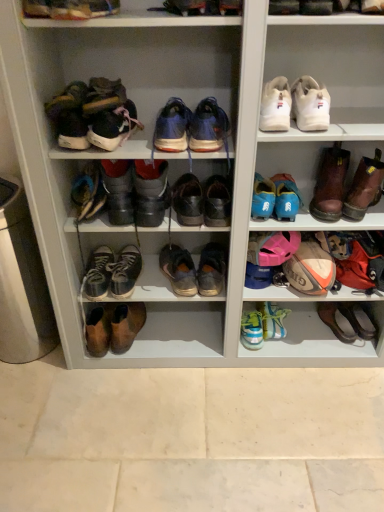
Question: Considering the relative sizes of white leather sneakers at upper right, which is counted as the ninth footwear, starting from the left, and worn leather shoes at center, placed as the 5th footwear when sorted from right to left, in the image provided, is white leather sneakers at upper right, which is counted as the ninth footwear, starting from the left, shorter than worn leather shoes at center, placed as the 5th footwear when sorted from right to left,?

Choices:
 (A) yes
 (B) no

Answer: (A)

Question: From the image's perspective, does white leather sneakers at upper right, which is counted as the ninth footwear, starting from the left, appear lower than worn leather shoes at center, placed as the 5th footwear when sorted from right to left?

Choices:
 (A) no
 (B) yes

Answer: (A)

Question: Can you confirm if white leather sneakers at upper right, which is counted as the ninth footwear, starting from the left, is positioned to the right of worn leather shoes at center, placed as the 5th footwear when sorted from right to left?

Choices:
 (A) no
 (B) yes

Answer: (B)

Question: Is white leather sneakers at upper right, which is counted as the ninth footwear, starting from the left, touching worn leather shoes at center, placed as the 7th footwear when sorted from left to right?

Choices:
 (A) no
 (B) yes

Answer: (A)

Question: Is white leather sneakers at upper right, which is counted as the ninth footwear, starting from the left, positioned behind worn leather shoes at center, placed as the 7th footwear when sorted from left to right?

Choices:
 (A) no
 (B) yes

Answer: (A)

Question: From a real-world perspective, is white leather sneakers at upper right, which ranks as the 3th footwear in right-to-left order, physically below worn leather shoes at center, placed as the 5th footwear when sorted from right to left?

Choices:
 (A) yes
 (B) no

Answer: (B)

Question: Is leather lace-up shoe at center, positioned as the 3th shoe in left-to-right order, located outside shiny blue sneakers at center, arranged as the 6th footwear when viewed from the right?

Choices:
 (A) yes
 (B) no

Answer: (A)

Question: From a real-world perspective, does leather lace-up shoe at center, positioned as the 3th shoe in left-to-right order, sit lower than shiny blue sneakers at center, arranged as the 6th footwear when viewed from the right?

Choices:
 (A) yes
 (B) no

Answer: (A)

Question: From a real-world perspective, is leather lace-up shoe at center, positioned as the 3th shoe in left-to-right order, positioned over shiny blue sneakers at center, placed as the sixth footwear when sorted from left to right, based on gravity?

Choices:
 (A) no
 (B) yes

Answer: (A)

Question: Considering the relative sizes of leather lace-up shoe at center, which is the 7th shoe in right-to-left order, and shiny blue sneakers at center, arranged as the 6th footwear when viewed from the right, in the image provided, is leather lace-up shoe at center, which is the 7th shoe in right-to-left order, bigger than shiny blue sneakers at center, arranged as the 6th footwear when viewed from the right,?

Choices:
 (A) yes
 (B) no

Answer: (A)

Question: Is leather lace-up shoe at center, which is the 7th shoe in right-to-left order, oriented towards shiny blue sneakers at center, arranged as the 6th footwear when viewed from the right?

Choices:
 (A) yes
 (B) no

Answer: (B)

Question: Would you say leather lace-up shoe at center, which is the 7th shoe in right-to-left order, is a long distance from shiny blue sneakers at center, arranged as the 6th footwear when viewed from the right?

Choices:
 (A) yes
 (B) no

Answer: (B)

Question: From the image's perspective, would you say leather at center, which appears as the 4th shoe when viewed from the right, is shown under leather shoes at center, acting as the 5th footwear starting from the left?

Choices:
 (A) yes
 (B) no

Answer: (A)